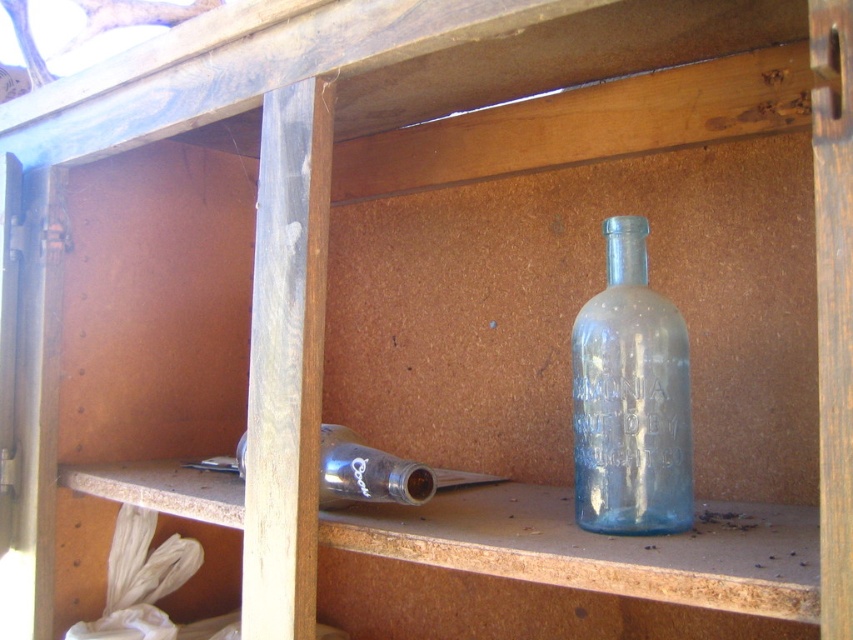
You are organizing items in a cabinet and need to place a new item between the blue glass bottle at center and the transparent glass bottle at lower left. What is the minimum distance you should maintain between them to ensure there is enough space?

The blue glass bottle at center is 7.39 inches from the transparent glass bottle at lower left, so you should maintain at least 7.39 inches of space between them to ensure there is enough space.

You are organizing items in a cabinet and need to place a new item between the blue glass bottle at center and the transparent glass bottle at lower left. Based on their widths, which bottle should be placed to the left to maintain a size gradient from narrow to wide?

The blue glass bottle at center has a lesser width compared to the transparent glass bottle at lower left. To maintain a size gradient from narrow to wide, the blue glass bottle at center should be placed to the left since it is narrower, followed by the wider transparent glass bottle at lower left.